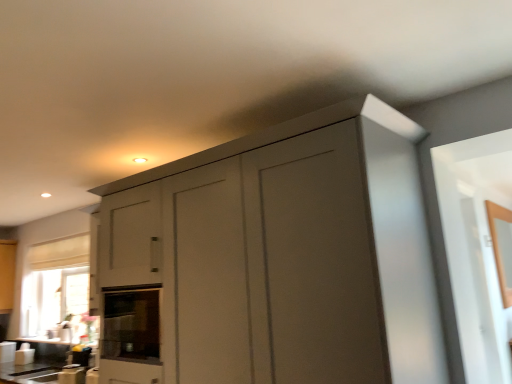
Question: Which is correct: white glossy countertop at lower left, the second counter top viewed from the front, is inside white glossy countertop at lower center, the 2th counter top positioned from the back, or outside of it?

Choices:
 (A) inside
 (B) outside

Answer: (B)

Question: Is white glossy countertop at lower left, positioned as the 1th counter top in back-to-front order, bigger or smaller than white glossy countertop at lower center, the 2th counter top positioned from the back?

Choices:
 (A) small
 (B) big

Answer: (A)

Question: Estimate the real-world distances between objects in this image. Which object is closer to the matte gray cabinet at center?

Choices:
 (A) black glass oven at center
 (B) white glossy countertop at lower center, the 2th counter top positioned from the back
 (C) white glossy countertop at lower left, the second counter top viewed from the front

Answer: (A)

Question: Which object is the closest to the white glossy countertop at lower left, positioned as the 1th counter top in back-to-front order?

Choices:
 (A) white glossy countertop at lower center, which appears as the 1th counter top when viewed from the front
 (B) black glass oven at center
 (C) matte gray cabinet at center

Answer: (A)